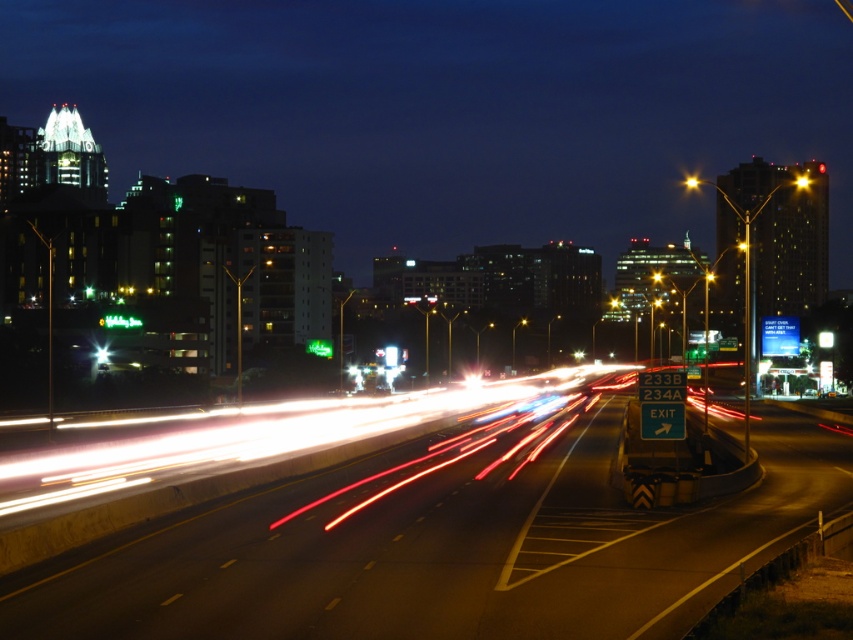
Question: Which point is farther from the camera taking this photo?

Choices:
 (A) (804, 180)
 (B) (693, 180)

Answer: (B)

Question: Does metallic asphalt highway at center have a larger size compared to yellow plastic traffic light at center-right?

Choices:
 (A) no
 (B) yes

Answer: (A)

Question: Which point is farther to the camera?

Choices:
 (A) (801, 184)
 (B) (372, 560)

Answer: (A)

Question: Which is nearer to the metallic asphalt highway at center?

Choices:
 (A) bright yellow streetlight at center-right
 (B) yellow plastic traffic light at center-right

Answer: (B)

Question: Is metallic asphalt highway at center bigger than bright yellow streetlight at center-right?

Choices:
 (A) yes
 (B) no

Answer: (A)

Question: Can you confirm if yellow plastic traffic light at center-right is positioned above bright yellow streetlight at center-right?

Choices:
 (A) yes
 (B) no

Answer: (B)